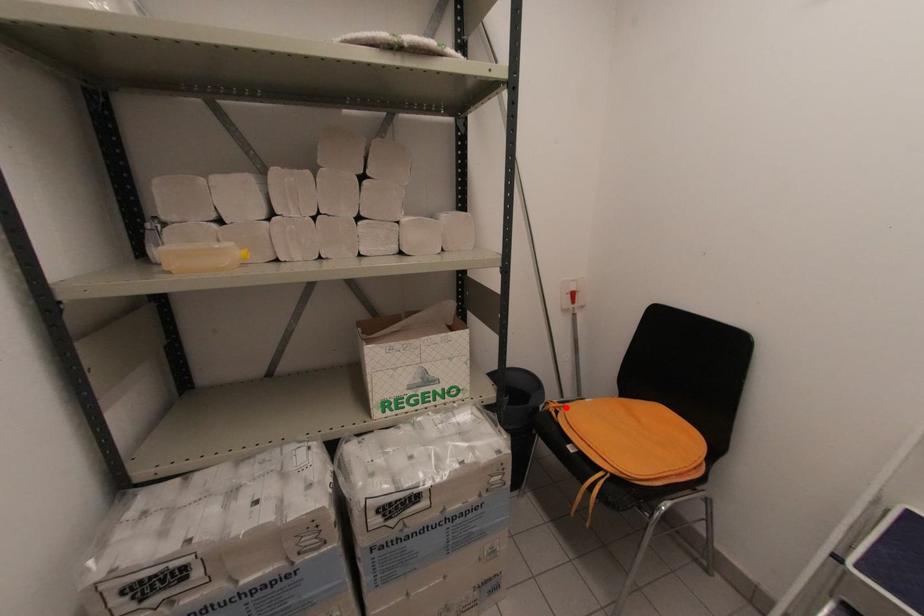
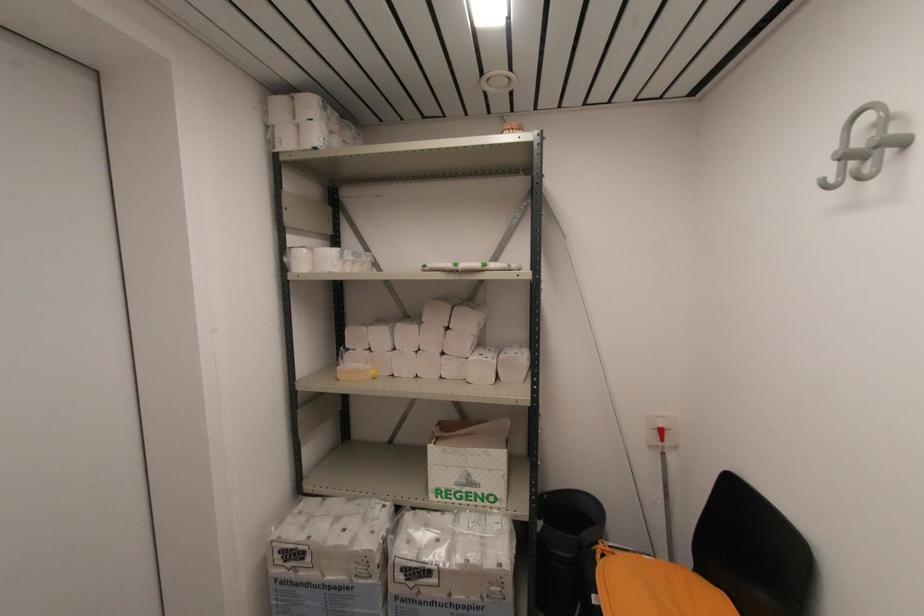
Find the pixel in the second image that matches the highlighted location in the first image.

(614, 554)